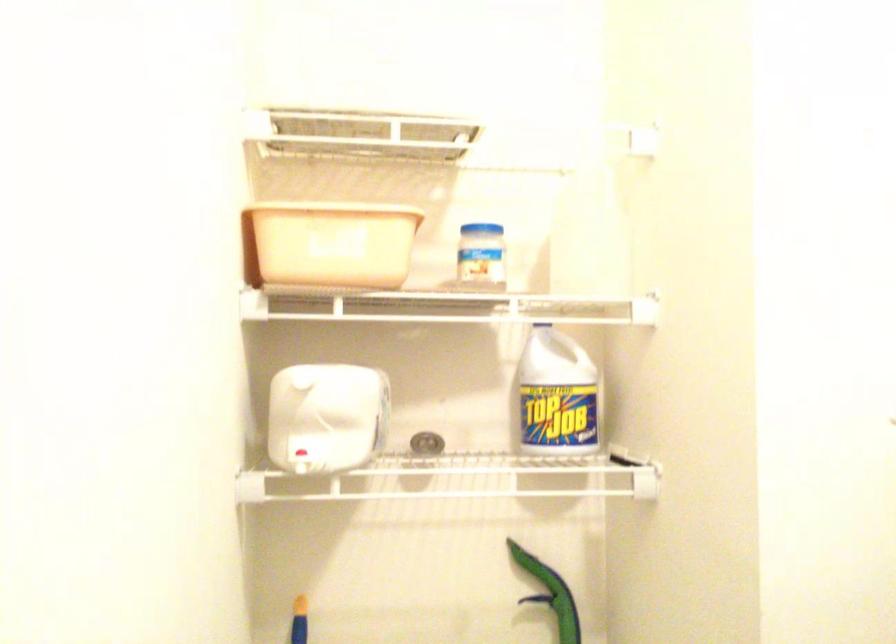
The height and width of the screenshot is (644, 896). In order to click on green tool handle in this screenshot , I will do `click(552, 594)`.